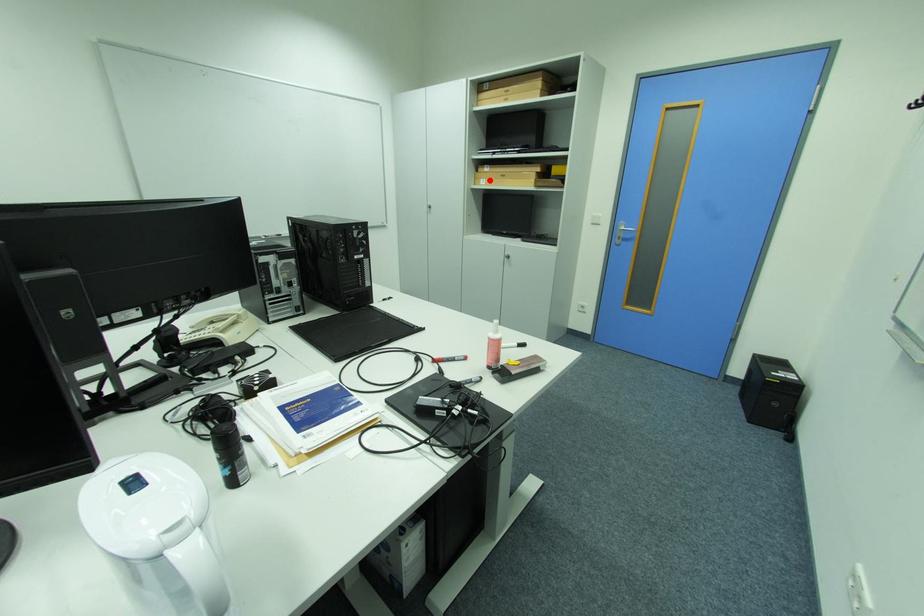
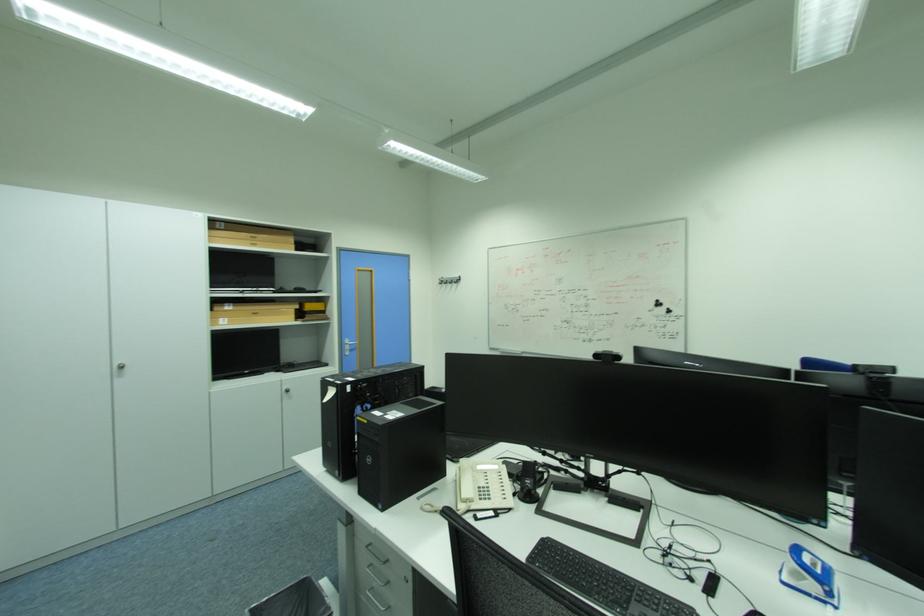
Find the pixel in the second image that matches the highlighted location in the first image.

(228, 320)